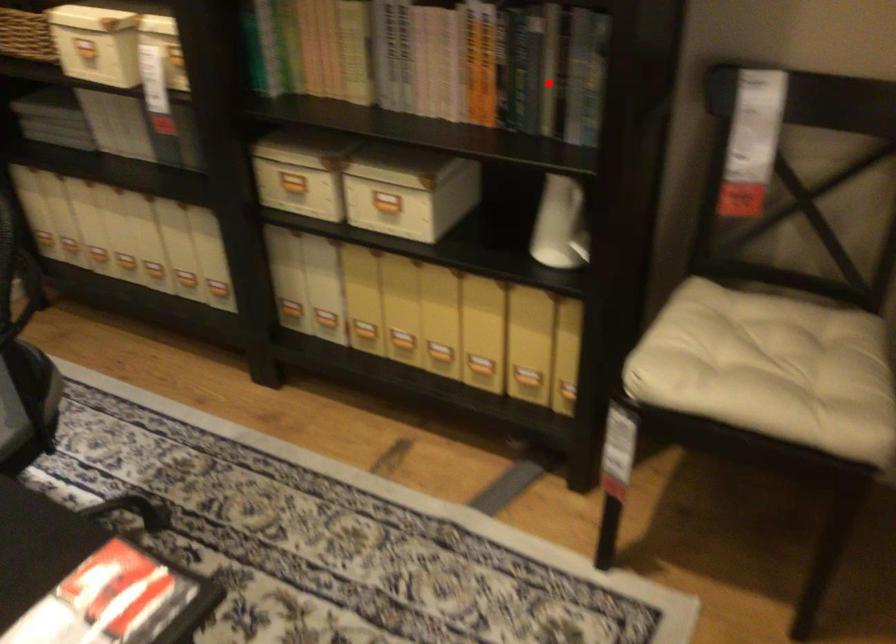
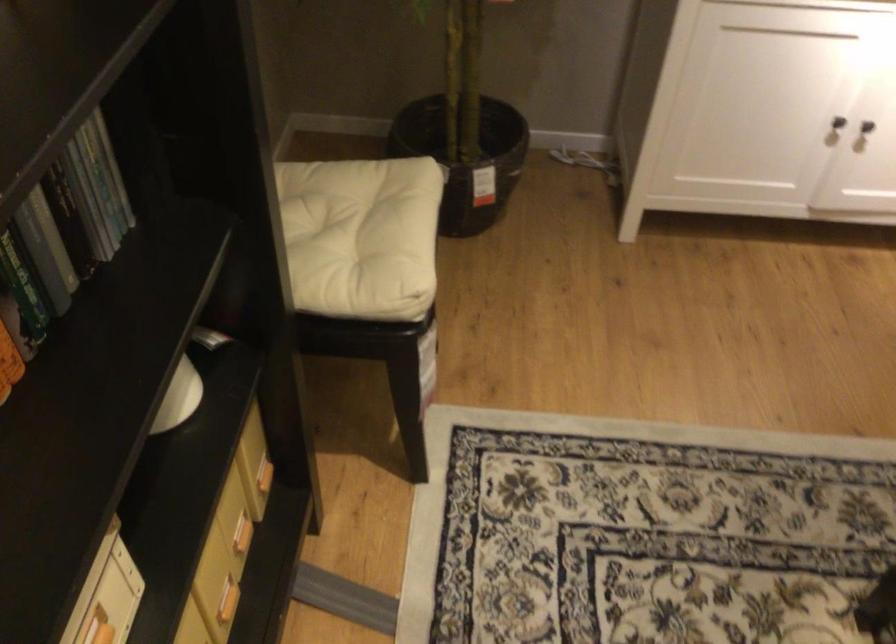
Question: A red point is marked in image1. In image2, is the corresponding 3D point closer to the camera or farther? Reply with the corresponding letter.

Choices:
 (A) The corresponding 3D point is closer.
 (B) The corresponding 3D point is farther.

Answer: (A)